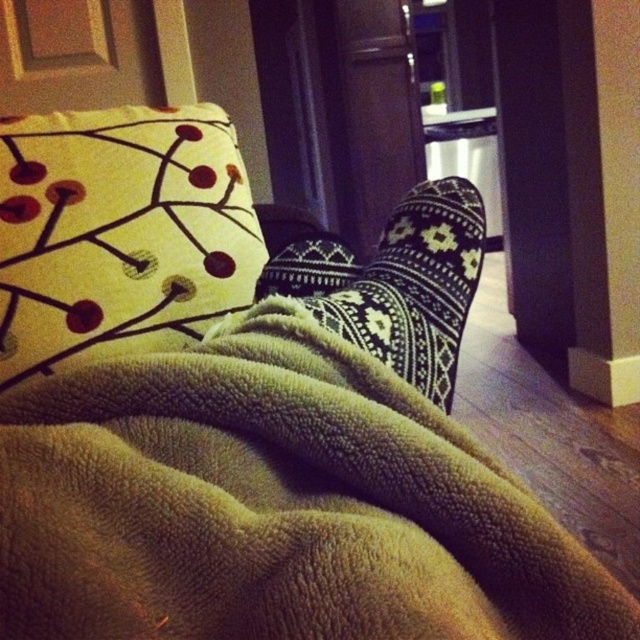
You are organizing a cozy reading corner and want to place the green fleece blanket at lower center and the yellow fabric pillow at upper left. Which item should you place first if you want the larger item closer to the center?

The yellow fabric pillow at upper left should be placed first because it is larger than the green fleece blanket at lower center and needs to be positioned closer to the center.

You are a photographer trying to capture a closeup of the green fleece blanket at lower center. Your camera has a minimum focusing distance of 10 inches. Can you take the photo without moving the blanket or the camera?

The green fleece blanket at lower center and camera are 10.16 inches apart from each other. Since the minimum focusing distance is 10 inches, the photographer can take the photo without moving the blanket or the camera because the distance is within the required range.

You are sitting on the couch and want to grab your phone that is at point (275, 506). Which object is your phone on?

The phone is on the green fleece blanket at lower center marked by point (275, 506).